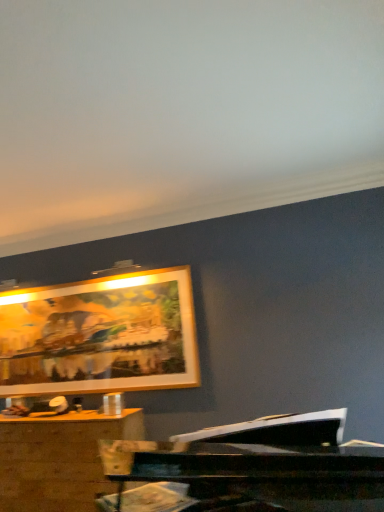
Identify the location of wooden desk at lower left. (59, 459).

Describe the element at coordinates (59, 459) in the screenshot. This screenshot has height=512, width=384. I see `wooden desk at lower left` at that location.

What are the coordinates of `gold-framed artwork at upper center` in the screenshot? It's located at (100, 335).

What do you see at coordinates (100, 335) in the screenshot?
I see `gold-framed artwork at upper center` at bounding box center [100, 335].

Find the location of a particular element. wooden desk at lower left is located at coordinates (59, 459).

Considering the positions of objects gold-framed artwork at upper center and wooden desk at lower left in the image provided, who is more to the left, gold-framed artwork at upper center or wooden desk at lower left?

wooden desk at lower left is more to the left.

Which object is more forward, gold-framed artwork at upper center or wooden desk at lower left?

wooden desk at lower left is in front.

Is point (123, 308) positioned after point (118, 439)?

Yes, it is behind point (118, 439).

From the image's perspective, is gold-framed artwork at upper center located above wooden desk at lower left?

Indeed, from the image's perspective, gold-framed artwork at upper center is shown above wooden desk at lower left.

From a real-world perspective, which is physically below, gold-framed artwork at upper center or wooden desk at lower left?

wooden desk at lower left, from a real-world perspective.

Between gold-framed artwork at upper center and wooden desk at lower left, which one has larger width?

wooden desk at lower left.

Who is shorter, gold-framed artwork at upper center or wooden desk at lower left?

wooden desk at lower left is shorter.

Does gold-framed artwork at upper center have a larger size compared to wooden desk at lower left?

No.

Would you say gold-framed artwork at upper center is outside wooden desk at lower left?

gold-framed artwork at upper center is positioned outside wooden desk at lower left.

Are gold-framed artwork at upper center and wooden desk at lower left making contact?

gold-framed artwork at upper center and wooden desk at lower left are not in contact.

Is gold-framed artwork at upper center oriented away from wooden desk at lower left?

No, wooden desk at lower left is not at the back of gold-framed artwork at upper center.

How different are the orientations of gold-framed artwork at upper center and wooden desk at lower left in degrees?

They differ by 0.0337 degrees in their facing directions.

Locate an element on the screen. The height and width of the screenshot is (512, 384). picture frame lying behind the wooden desk at lower left is located at coordinates (100, 335).

Does wooden desk at lower left appear on the left side of gold-framed artwork at upper center?

Yes.

Relative to gold-framed artwork at upper center, is wooden desk at lower left in front or behind?

wooden desk at lower left is in front of gold-framed artwork at upper center.

Is point (23, 420) less distant than point (43, 369)?

Yes.

From the image's perspective, is wooden desk at lower left on gold-framed artwork at upper center?

No, from the image's perspective, wooden desk at lower left is not above gold-framed artwork at upper center.

From a real-world perspective, which is physically below, wooden desk at lower left or gold-framed artwork at upper center?

wooden desk at lower left, from a real-world perspective.

Can you confirm if wooden desk at lower left is wider than gold-framed artwork at upper center?

Yes.

Can you confirm if wooden desk at lower left is taller than gold-framed artwork at upper center?

No, wooden desk at lower left is not taller than gold-framed artwork at upper center.

Does wooden desk at lower left have a larger size compared to gold-framed artwork at upper center?

Yes.

Consider the image. Is wooden desk at lower left spatially inside gold-framed artwork at upper center, or outside of it?

wooden desk at lower left cannot be found inside gold-framed artwork at upper center.

Can you see wooden desk at lower left touching gold-framed artwork at upper center?

No, wooden desk at lower left is not making contact with gold-framed artwork at upper center.

Is wooden desk at lower left turned away from gold-framed artwork at upper center?

No, wooden desk at lower left's orientation is not away from gold-framed artwork at upper center.

Identify the location of desk below the gold-framed artwork at upper center (from a real-world perspective). (59, 459).

Find the location of `picture frame above the wooden desk at lower left (from a real-world perspective)`. picture frame above the wooden desk at lower left (from a real-world perspective) is located at coordinates pos(100,335).

You are a GUI agent. You are given a task and a screenshot of the screen. Output one action in this format:
    pyautogui.click(x=<x>, y=<y>)
    Task: Click on the desk located below the gold-framed artwork at upper center (from the image's perspective)
    
    Given the screenshot: What is the action you would take?
    pyautogui.click(x=59, y=459)